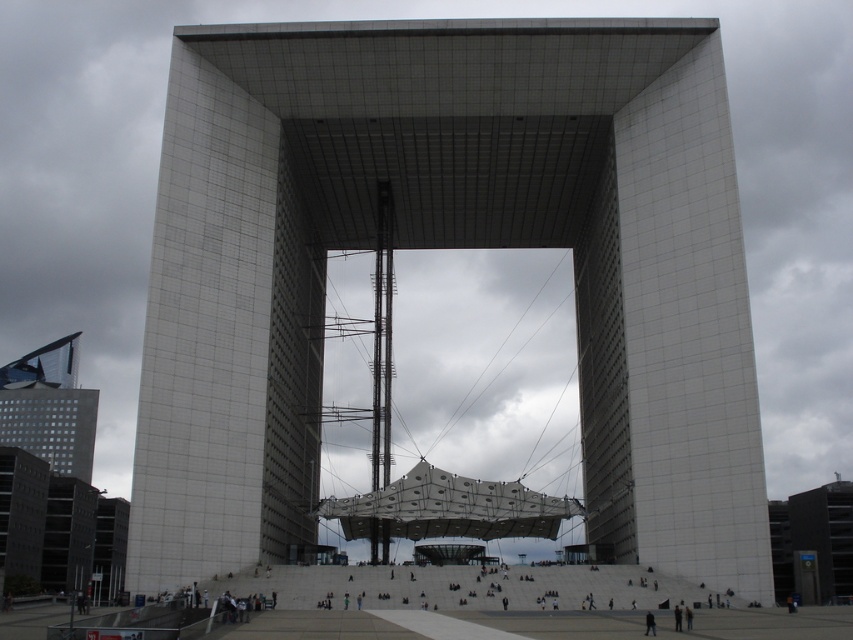
Is white textured tower at center to the left of matte glass skyscraper at left from the viewer's perspective?

In fact, white textured tower at center is to the right of matte glass skyscraper at left.

Is white textured tower at center bigger than matte glass skyscraper at left?

Correct, white textured tower at center is larger in size than matte glass skyscraper at left.

This screenshot has height=640, width=853. What do you see at coordinates (448, 246) in the screenshot? I see `white textured tower at center` at bounding box center [448, 246].

What are the coordinates of `white textured tower at center` in the screenshot? It's located at (448, 246).